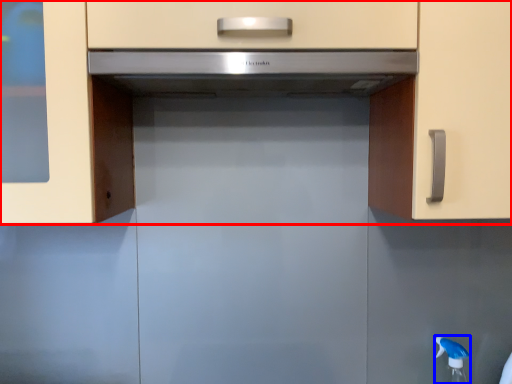
Question: Which object appears farthest to the camera in this image, cabinetry (highlighted by a red box) or faucet (highlighted by a blue box)?

Choices:
 (A) cabinetry
 (B) faucet

Answer: (B)